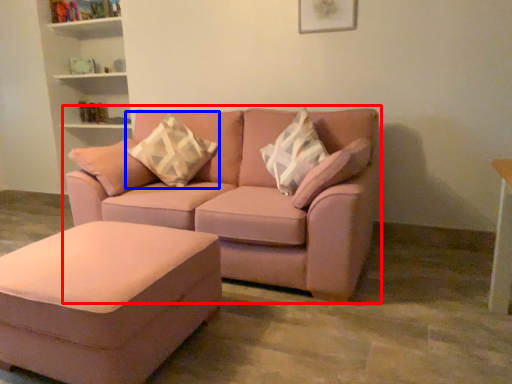
Question: Which of the following is the farthest to the observer, studio couch (highlighted by a red box) or pillow (highlighted by a blue box)?

Choices:
 (A) studio couch
 (B) pillow

Answer: (B)